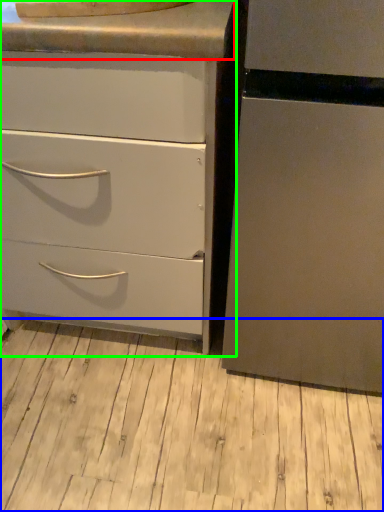
Question: Which object is the closest to the counter top (highlighted by a red box)? Choose among these: plank (highlighted by a blue box) or chest of drawers (highlighted by a green box).

Choices:
 (A) plank
 (B) chest of drawers

Answer: (B)